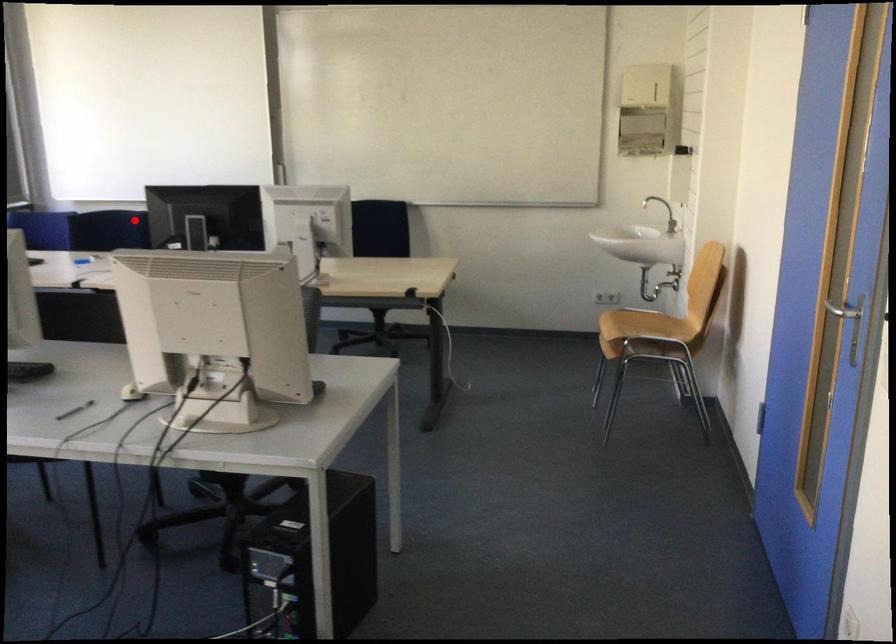
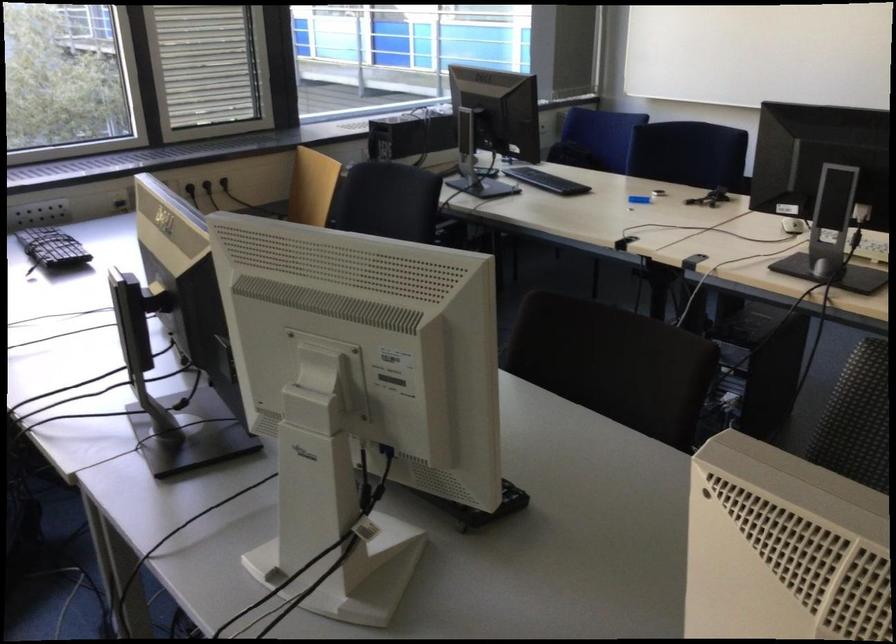
Question: A red point is marked in image1. In image2, is the corresponding 3D point closer to the camera or farther? Reply with the corresponding letter.

Choices:
 (A) The corresponding 3D point is closer.
 (B) The corresponding 3D point is farther.

Answer: (A)